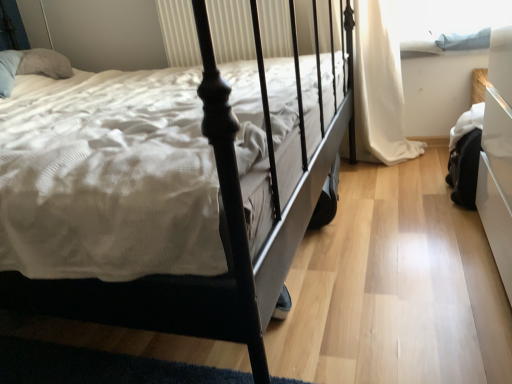
Question: Is blue fabric at upper right turned away from matte black bed at center?

Choices:
 (A) yes
 (B) no

Answer: (B)

Question: Is blue fabric at upper right positioned beyond the bounds of matte black bed at center?

Choices:
 (A) yes
 (B) no

Answer: (A)

Question: Is blue fabric at upper right oriented towards matte black bed at center?

Choices:
 (A) no
 (B) yes

Answer: (A)

Question: Can you confirm if blue fabric at upper right is smaller than matte black bed at center?

Choices:
 (A) yes
 (B) no

Answer: (A)

Question: Is blue fabric at upper right to the right of matte black bed at center from the viewer's perspective?

Choices:
 (A) yes
 (B) no

Answer: (A)

Question: Is white fabric curtain at right situated inside matte black bed at center or outside?

Choices:
 (A) outside
 (B) inside

Answer: (A)

Question: Is point (359, 139) closer or farther from the camera than point (246, 307)?

Choices:
 (A) closer
 (B) farther

Answer: (B)

Question: From the image's perspective, is white fabric curtain at right located above or below matte black bed at center?

Choices:
 (A) above
 (B) below

Answer: (A)

Question: Visually, is white fabric curtain at right positioned to the left or to the right of matte black bed at center?

Choices:
 (A) left
 (B) right

Answer: (B)

Question: Considering the positions of matte black bed at center and white fabric curtain at right in the image, is matte black bed at center bigger or smaller than white fabric curtain at right?

Choices:
 (A) big
 (B) small

Answer: (A)

Question: From the image's perspective, relative to white fabric curtain at right, is matte black bed at center above or below?

Choices:
 (A) below
 (B) above

Answer: (A)

Question: In terms of width, does matte black bed at center look wider or thinner when compared to white fabric curtain at right?

Choices:
 (A) wide
 (B) thin

Answer: (A)

Question: From a real-world perspective, is matte black bed at center above or below white fabric curtain at right?

Choices:
 (A) above
 (B) below

Answer: (A)

Question: From the image's perspective, relative to white fabric curtain at right, is blue fabric at upper right above or below?

Choices:
 (A) above
 (B) below

Answer: (A)

Question: Considering their positions, is blue fabric at upper right located in front of or behind white fabric curtain at right?

Choices:
 (A) behind
 (B) front

Answer: (A)